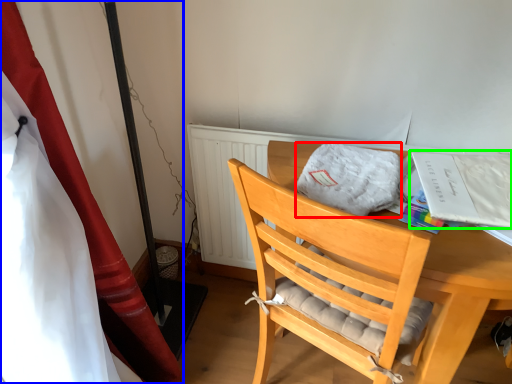
Question: Which object is positioned farthest from cloth (highlighted by a red box)? Select from curtain (highlighted by a blue box) and magazine (highlighted by a green box).

Choices:
 (A) curtain
 (B) magazine

Answer: (A)